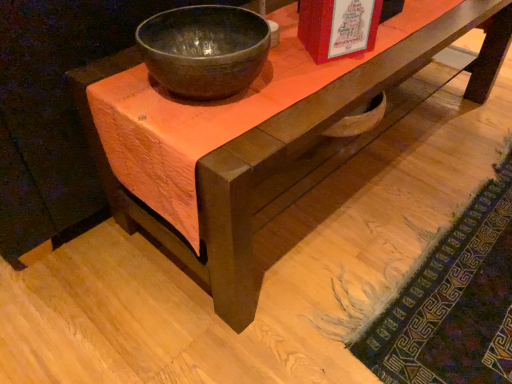
Find the location of a particular element. The image size is (512, 384). free spot in front of matte dark gray bowl at center is located at coordinates (214, 135).